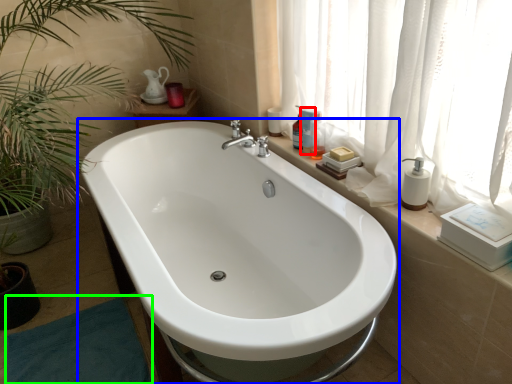
Question: Which object is the farthest from toiletry (highlighted by a red box)? Choose among these: bathtub (highlighted by a blue box) or bath mat (highlighted by a green box).

Choices:
 (A) bathtub
 (B) bath mat

Answer: (B)